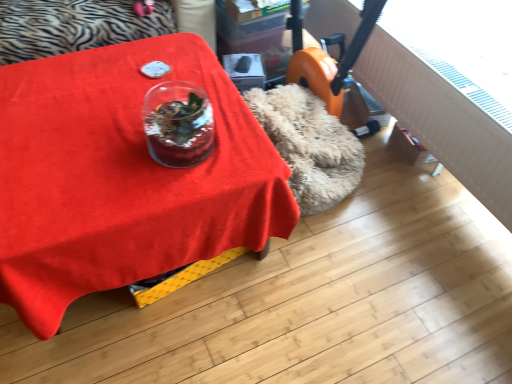
Identify the location of vacant area on the back side of transparent glass vase at center. This screenshot has width=512, height=384. (186, 97).